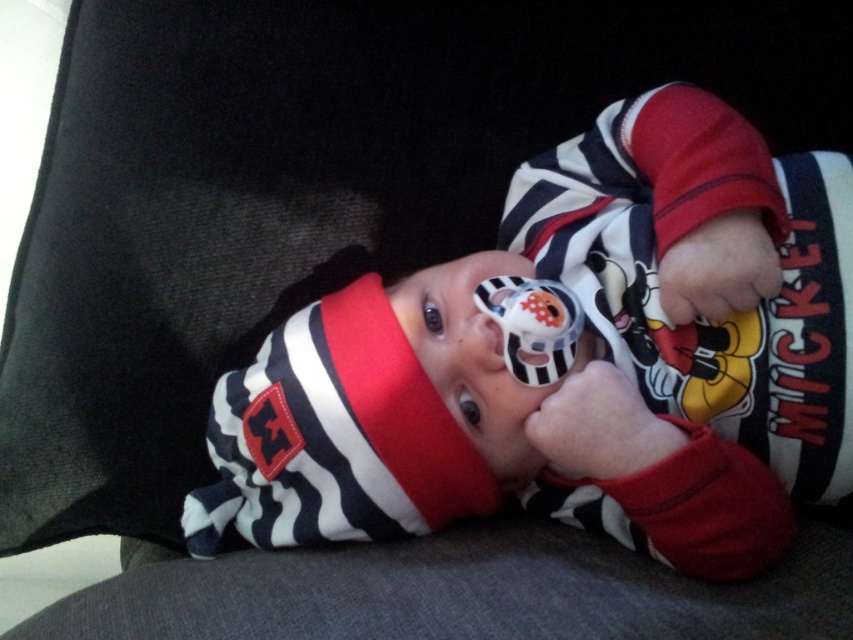
Is point (401, 301) closer to camera compared to point (531, 374)?

No, it is not.

In the scene shown: Can you confirm if striped fabric baby at center is positioned to the right of matte plastic pacifier at center?

Incorrect, striped fabric baby at center is not on the right side of matte plastic pacifier at center.

What do you see at coordinates (569, 369) in the screenshot? The width and height of the screenshot is (853, 640). I see `striped fabric baby at center` at bounding box center [569, 369].

The image size is (853, 640). I want to click on striped fabric baby at center, so click(569, 369).